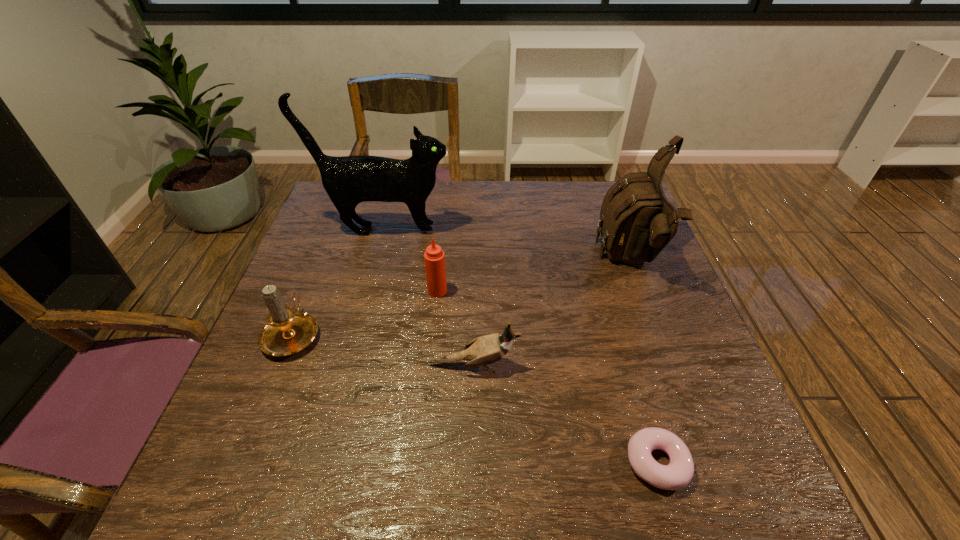
Locate an element on the screen. This screenshot has width=960, height=540. doughnut positioned at the right edge is located at coordinates (677, 474).

Image resolution: width=960 pixels, height=540 pixels. In order to click on object situated at the far left corner in this screenshot , I will do `click(349, 180)`.

You are a GUI agent. You are given a task and a screenshot of the screen. Output one action in this format:
    pyautogui.click(x=<x>, y=<y>)
    Task: Click on the object that is positioned at the near right corner
    
    Given the screenshot: What is the action you would take?
    pyautogui.click(x=677, y=474)

This screenshot has width=960, height=540. I want to click on vacant region at the far edge, so click(x=439, y=209).

The image size is (960, 540). I want to click on vacant region at the near edge of the desktop, so click(471, 467).

Find the location of `vacant space at the left edge of the desktop`. vacant space at the left edge of the desktop is located at coordinates (300, 262).

Where is `vacant area that lies between the bird and the candle`? The height and width of the screenshot is (540, 960). vacant area that lies between the bird and the candle is located at coordinates (384, 349).

I want to click on empty space between the second tallest object and the bird, so click(553, 313).

Image resolution: width=960 pixels, height=540 pixels. Find the location of `free space between the Tabasco sauce and the doughnut`. free space between the Tabasco sauce and the doughnut is located at coordinates (547, 377).

Where is `free point between the bird and the candle`? The width and height of the screenshot is (960, 540). free point between the bird and the candle is located at coordinates (384, 349).